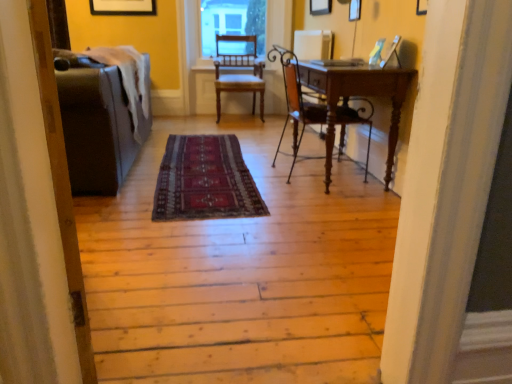
This screenshot has height=384, width=512. Identify the location of blank area beneath matte black couch at left (from a real-world perspective). coord(95,301).